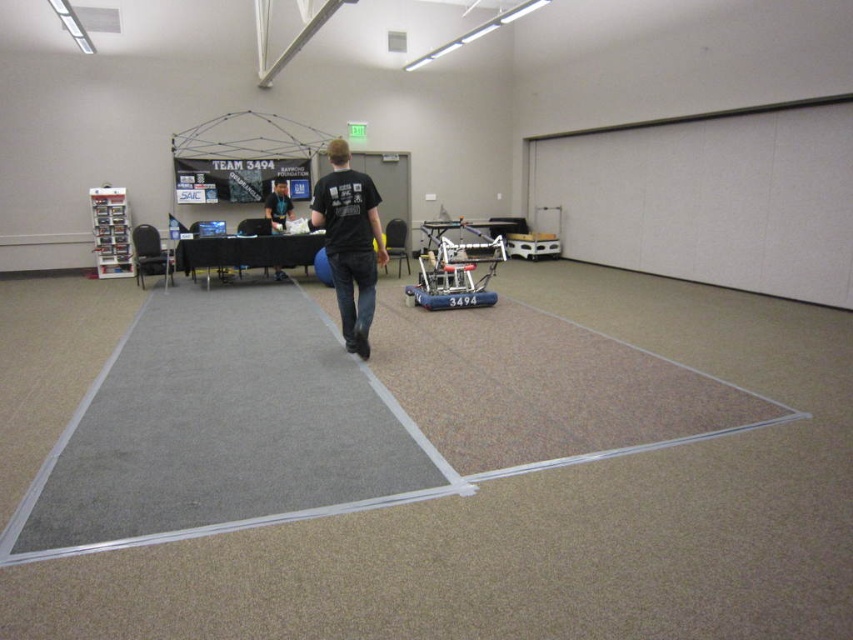
Between black cotton shirt at center and black matte shirt at center, which one has less height?

black matte shirt at center

Is point (321, 218) positioned behind point (277, 186)?

That is False.

Identify the location of black cotton shirt at center. The height and width of the screenshot is (640, 853). (349, 241).

Between black cotton shirt at center and blue rubber robot at center, which one is positioned lower?

Positioned lower is blue rubber robot at center.

Which is in front, point (340, 301) or point (445, 304)?

Point (340, 301) is more forward.

Where is `black cotton shirt at center`? black cotton shirt at center is located at coordinates (349, 241).

Can you confirm if blue rubber robot at center is shorter than black matte shirt at center?

Yes.

Can you confirm if blue rubber robot at center is positioned below black matte shirt at center?

Yes.

In order to click on blue rubber robot at center in this screenshot , I will do `click(456, 266)`.